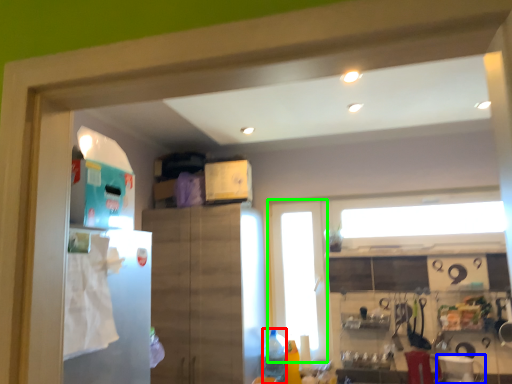
Question: Estimate the real-world distances between objects in this image. Which object is farther from bottle (highlighted by a red box), appliance (highlighted by a blue box) or glass door (highlighted by a green box)?

Choices:
 (A) appliance
 (B) glass door

Answer: (A)